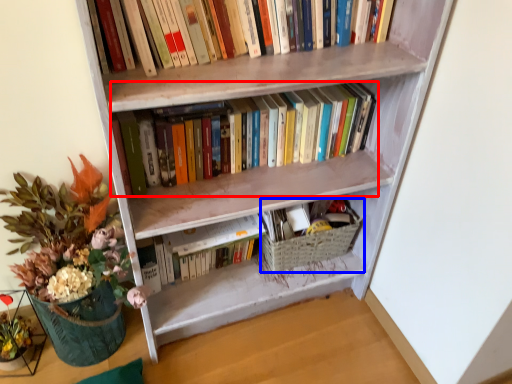
Question: Which of the following is the closest to the observer, book (highlighted by a red box) or basket (highlighted by a blue box)?

Choices:
 (A) book
 (B) basket

Answer: (A)